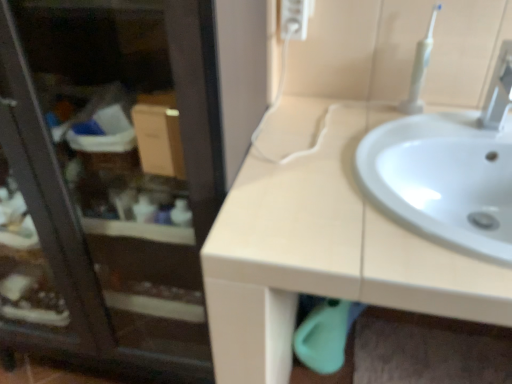
In order to click on free space to the left of white plastic tap at upper right in this screenshot , I will do `click(413, 134)`.